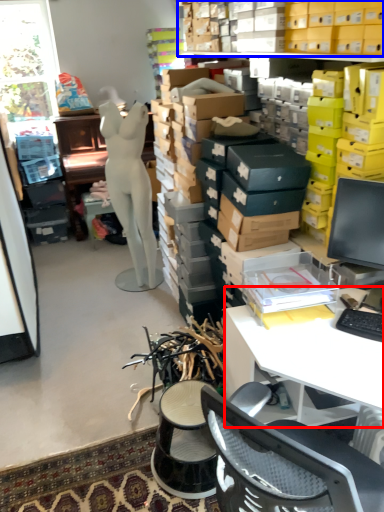
Question: Which point is further to the camera, desk (highlighted by a red box) or shelf (highlighted by a blue box)?

Choices:
 (A) desk
 (B) shelf

Answer: (B)